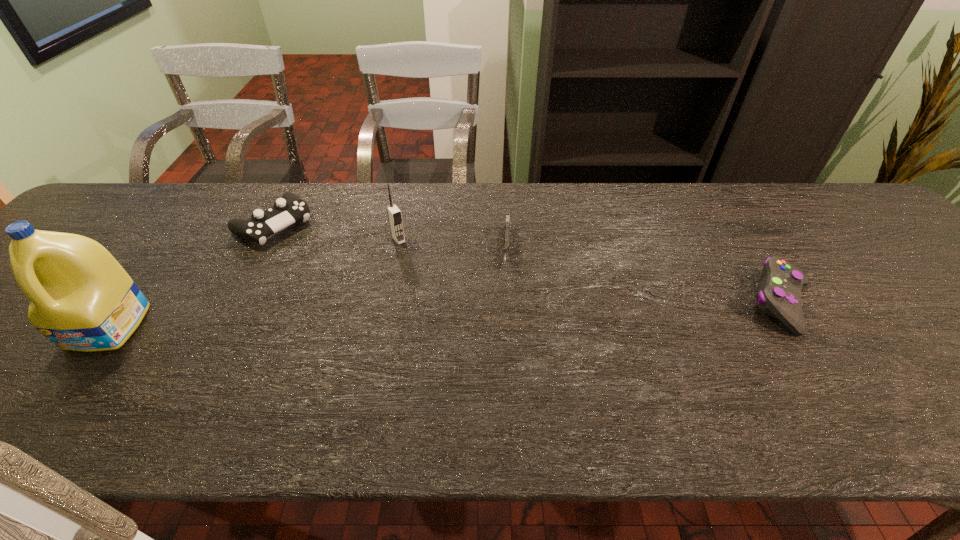
Find the location of a particular element. Image resolution: width=960 pixels, height=540 pixels. free space located on the label of the leftmost object is located at coordinates (63, 387).

Find the location of a particular element. free location located on the right of the rightmost object is located at coordinates (854, 303).

Where is `free space located aimed along the barrel of the second object from right to left`? free space located aimed along the barrel of the second object from right to left is located at coordinates (507, 308).

I want to click on vacant region located aimed along the barrel of the second object from right to left, so click(x=506, y=326).

Where is `vacant point located 0.130m aimed along the barrel of the second object from right to left`? The image size is (960, 540). vacant point located 0.130m aimed along the barrel of the second object from right to left is located at coordinates (506, 315).

You are a GUI agent. You are given a task and a screenshot of the screen. Output one action in this format:
    pyautogui.click(x=<x>, y=<y>)
    Task: Click on the blank space located on the front-facing side of the third object from right to left
    The height and width of the screenshot is (540, 960).
    Given the screenshot: What is the action you would take?
    pyautogui.click(x=448, y=303)

Where is `vacant region located 0.340m on the front-facing side of the third object from right to left`? vacant region located 0.340m on the front-facing side of the third object from right to left is located at coordinates (469, 329).

The image size is (960, 540). In order to click on free space located on the front-facing side of the third object from right to left in this screenshot , I will do `click(436, 287)`.

At what (x,y) coordinates should I click in order to perform the action: click on vacant space located 0.190m on the surface of the farther control. Please return your answer as a coordinate pair (x, y). Looking at the image, I should click on (338, 273).

Find the location of a particular element. vacant area located on the surface of the farther control is located at coordinates (343, 276).